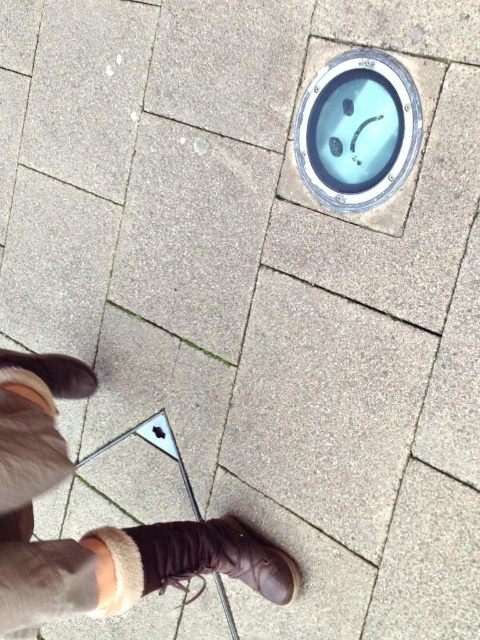
You are a delivery person trying to avoid stepping on the blue glossy manhole cover at upper center and the brown suede boot at lower center. Since you need to walk from the left side to the right side of the image, which object should you avoid stepping on first?

The blue glossy manhole cover at upper center is located above the brown suede boot at lower center. Since you are walking from left to right, you would encounter the brown suede boot at lower center first before reaching the blue glossy manhole cover at upper center.

You are standing on the paved area and see the brown suede boots at lower center and the brown suede boot at lower center. Which one is closer to you?

The brown suede boots at lower center is closer to you because it is in front of the brown suede boot at lower center.

You are a delivery person trying to avoid stepping on the blue glossy manhole cover at upper center and the brown suede boot at lower center. Which object should you avoid stepping on first if you are walking from the bottom of the image upwards?

You should avoid stepping on the brown suede boot at lower center first because it is closer to your path when walking upwards from the bottom of the image.